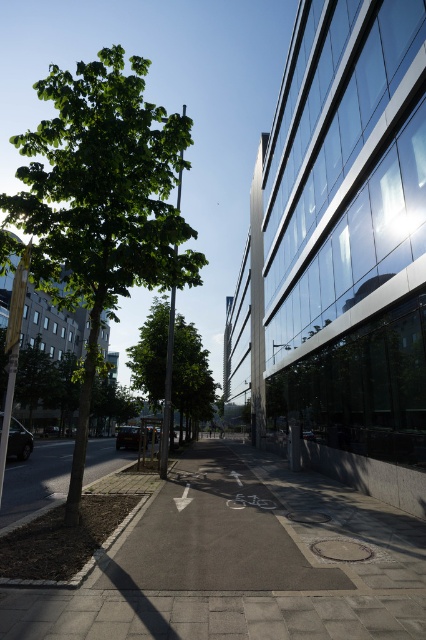
You are a city planner analyzing the urban street scene. You need to determine which area takes up more space in the image between the gray asphalt at center and the green leafy tree at center. Which one occupies a larger portion of the image?

The green leafy tree at center occupies more space than the gray asphalt at center in the image.

You are a pedestrian standing on the sidewalk and want to walk to the gray asphalt at center. Which direction should you walk to avoid the green leafy tree at left?

To reach the gray asphalt at center while avoiding the green leafy tree at left, you should walk towards the right side of the image since the gray asphalt at center is in front of the green leafy tree at left, meaning it is positioned between you and the tree. However, since the tree is on the left, moving towards the right would place the tree behind you and allow you to proceed safely toward the asphalt area.